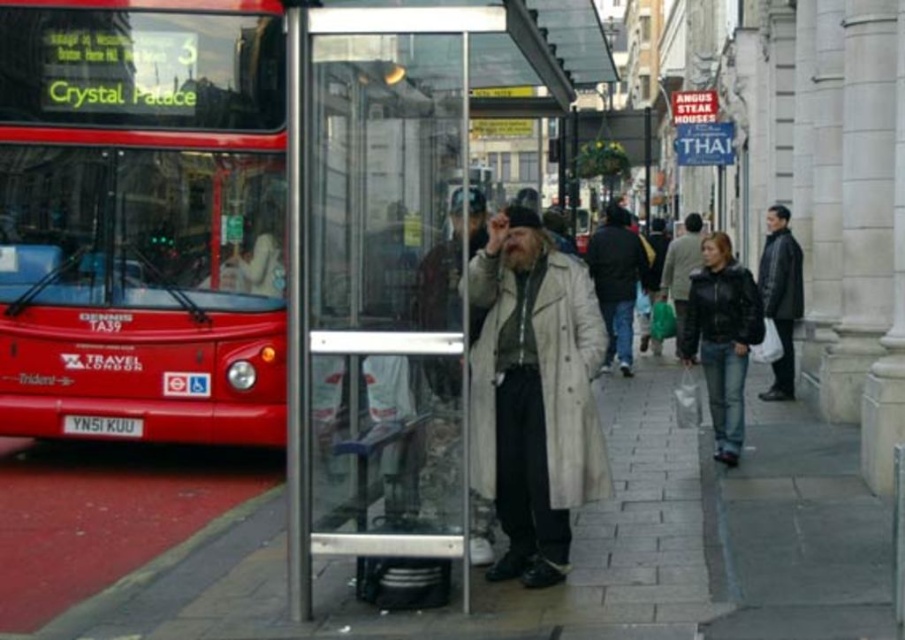
You are a photographer trying to capture both the light beige coat at center and the dark gray coat at center in a single frame. Based on their widths, which coat will appear wider in the photo?

The dark gray coat at center will appear wider in the photo since it has a greater width compared to the light beige coat at center.

You are at a bus stop and see two coats hanging on a rack inside the shelter. The coats are labeled as light beige coat at center and dark gray coat at center. Which coat is positioned to the left when facing the coats from the front?

The light beige coat at center is positioned to the left of the dark gray coat at center when facing the coats from the front.